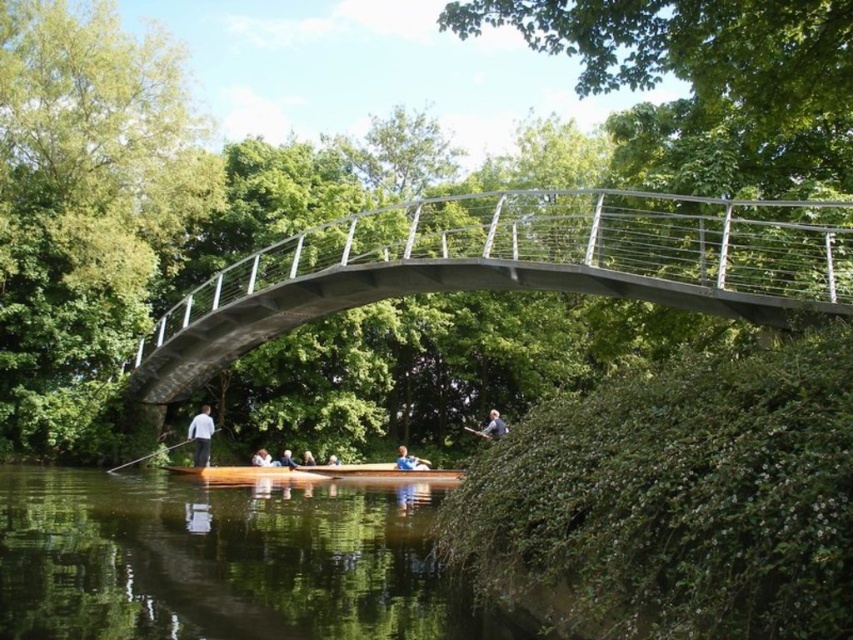
Which is in front, point (737, 234) or point (257, 451)?

Point (737, 234) is in front.

Can you confirm if metallic gray bridge at center is positioned to the left of white fabric person at lower center?

No, metallic gray bridge at center is not to the left of white fabric person at lower center.

Is point (270, 320) positioned before point (271, 461)?

Yes.

You are a GUI agent. You are given a task and a screenshot of the screen. Output one action in this format:
    pyautogui.click(x=<x>, y=<y>)
    Task: Click on the metallic gray bridge at center
    
    Given the screenshot: What is the action you would take?
    pyautogui.click(x=514, y=266)

Does light gray fabric jacket at lower center appear over light blue fabric shirt at center?

Yes.

Which is below, light gray fabric jacket at lower center or light blue fabric shirt at center?

Positioned lower is light blue fabric shirt at center.

In order to click on light gray fabric jacket at lower center in this screenshot , I will do `click(492, 426)`.

Where is `light gray fabric jacket at lower center`? light gray fabric jacket at lower center is located at coordinates (492, 426).

Which is behind, point (418, 464) or point (286, 465)?

Point (418, 464)

Who is more forward, (401, 456) or (291, 460)?

Point (401, 456)

Where is `blue fabric boat at center`? blue fabric boat at center is located at coordinates (409, 460).

What are the coordinates of `blue fabric boat at center` in the screenshot? It's located at (409, 460).